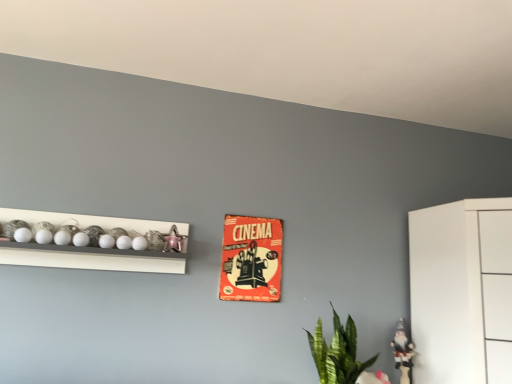
Question: Does red cardboard cinema poster at center have a larger size compared to white glossy shelf at upper left?

Choices:
 (A) yes
 (B) no

Answer: (B)

Question: Can you confirm if red cardboard cinema poster at center is positioned to the right of white glossy shelf at upper left?

Choices:
 (A) no
 (B) yes

Answer: (B)

Question: Is red cardboard cinema poster at center thinner than white glossy shelf at upper left?

Choices:
 (A) no
 (B) yes

Answer: (B)

Question: Is red cardboard cinema poster at center smaller than white glossy shelf at upper left?

Choices:
 (A) no
 (B) yes

Answer: (B)

Question: Considering the relative sizes of red cardboard cinema poster at center and white glossy shelf at upper left in the image provided, is red cardboard cinema poster at center taller than white glossy shelf at upper left?

Choices:
 (A) yes
 (B) no

Answer: (A)

Question: From the image's perspective, relative to metallic pink star at upper left, marked as the 2th toy in a bottom-to-top arrangement, is white glossy gnome at lower right, which is counted as the 2th toy, starting from the left, above or below?

Choices:
 (A) above
 (B) below

Answer: (B)

Question: In terms of height, does white glossy gnome at lower right, arranged as the second toy when viewed from the front, look taller or shorter compared to metallic pink star at upper left, acting as the first toy starting from the front?

Choices:
 (A) tall
 (B) short

Answer: (A)

Question: Is white glossy gnome at lower right, the first toy viewed from the right, in front of or behind metallic pink star at upper left, marked as the 2th toy in a bottom-to-top arrangement, in the image?

Choices:
 (A) behind
 (B) front

Answer: (A)

Question: Is point (402, 362) positioned closer to the camera than point (169, 228)?

Choices:
 (A) closer
 (B) farther

Answer: (B)

Question: Based on their positions, is metallic pink star at upper left, the 2th toy in the back-to-front sequence, located to the left or right of green leafy plant at lower right?

Choices:
 (A) right
 (B) left

Answer: (B)

Question: In terms of height, does metallic pink star at upper left, marked as the 1th toy in a top-to-bottom arrangement, look taller or shorter compared to green leafy plant at lower right?

Choices:
 (A) short
 (B) tall

Answer: (A)

Question: Based on their sizes in the image, would you say metallic pink star at upper left, the first toy from the left, is bigger or smaller than green leafy plant at lower right?

Choices:
 (A) small
 (B) big

Answer: (A)

Question: Which is correct: metallic pink star at upper left, acting as the first toy starting from the front, is inside green leafy plant at lower right, or outside of it?

Choices:
 (A) inside
 (B) outside

Answer: (B)

Question: From a real-world perspective, is green leafy plant at lower right above or below red cardboard cinema poster at center?

Choices:
 (A) above
 (B) below

Answer: (B)

Question: Looking at their shapes, would you say green leafy plant at lower right is wider or thinner than red cardboard cinema poster at center?

Choices:
 (A) wide
 (B) thin

Answer: (A)